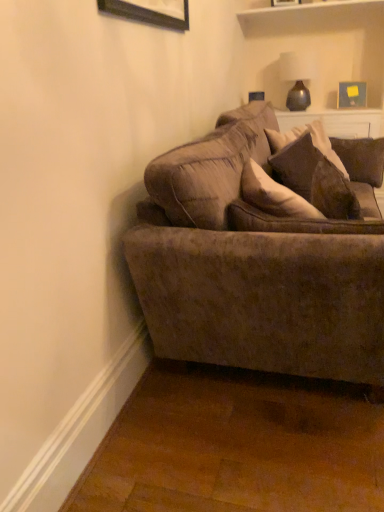
Question: Does velvet brown couch at center have a lesser width compared to wooden picture frame at upper center, the second picture frame positioned from the right?

Choices:
 (A) yes
 (B) no

Answer: (B)

Question: Considering the relative sizes of velvet brown couch at center and wooden picture frame at upper center, arranged as the second picture frame when ordered from the bottom, in the image provided, is velvet brown couch at center taller than wooden picture frame at upper center, arranged as the second picture frame when ordered from the bottom,?

Choices:
 (A) no
 (B) yes

Answer: (B)

Question: Does velvet brown couch at center appear on the left side of wooden picture frame at upper center, the second picture frame positioned from the right?

Choices:
 (A) no
 (B) yes

Answer: (B)

Question: Are velvet brown couch at center and wooden picture frame at upper center, which ranks as the first picture frame in top-to-bottom order, beside each other?

Choices:
 (A) no
 (B) yes

Answer: (A)

Question: Does velvet brown couch at center have a lesser height compared to wooden picture frame at upper center, which ranks as the first picture frame in top-to-bottom order?

Choices:
 (A) yes
 (B) no

Answer: (B)

Question: In the image, is velvet brown couch at center on the left side or the right side of wooden picture frame at upper right, acting as the second picture frame starting from the top?

Choices:
 (A) right
 (B) left

Answer: (B)

Question: Is point (180, 287) closer or farther from the camera than point (350, 87)?

Choices:
 (A) farther
 (B) closer

Answer: (B)

Question: From the image's perspective, is velvet brown couch at center above or below wooden picture frame at upper right, the 1th picture frame viewed from the right?

Choices:
 (A) above
 (B) below

Answer: (B)

Question: In terms of size, does velvet brown couch at center appear bigger or smaller than wooden picture frame at upper right, the 1th picture frame viewed from the right?

Choices:
 (A) small
 (B) big

Answer: (B)

Question: In terms of width, does matte brown vase at upper right look wider or thinner when compared to velvet brown pillow at upper right?

Choices:
 (A) thin
 (B) wide

Answer: (B)

Question: Is matte brown vase at upper right in front of or behind velvet brown pillow at upper right in the image?

Choices:
 (A) behind
 (B) front

Answer: (A)

Question: Considering the positions of matte brown vase at upper right and velvet brown pillow at upper right in the image, is matte brown vase at upper right bigger or smaller than velvet brown pillow at upper right?

Choices:
 (A) big
 (B) small

Answer: (A)

Question: Considering the positions of point (x=288, y=60) and point (x=337, y=209), is point (x=288, y=60) closer or farther from the camera than point (x=337, y=209)?

Choices:
 (A) farther
 (B) closer

Answer: (A)

Question: Relative to wooden picture frame at upper right, the first picture frame ordered from the bottom, is wooden picture frame at upper center, placed as the 2th picture frame when sorted from back to front, in front or behind?

Choices:
 (A) behind
 (B) front

Answer: (B)

Question: In terms of height, does wooden picture frame at upper center, which ranks as the first picture frame in top-to-bottom order, look taller or shorter compared to wooden picture frame at upper right, which is the 2th picture frame in front-to-back order?

Choices:
 (A) tall
 (B) short

Answer: (B)